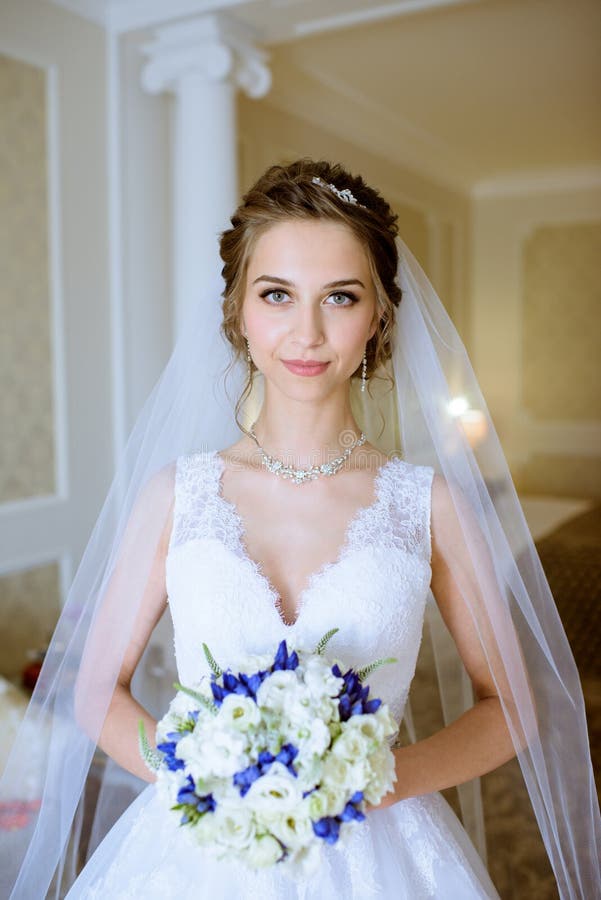
This screenshot has height=900, width=601. I want to click on flower bouquet, so click(273, 739).